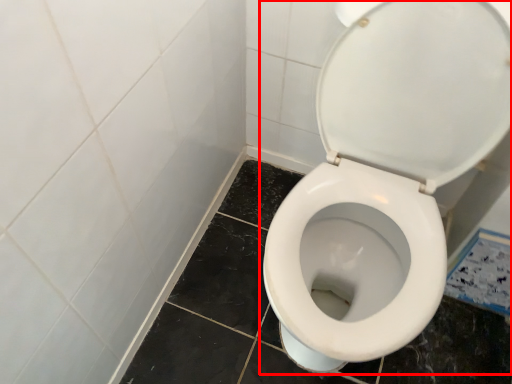
Question: In this image, where is toilet (annotated by the red box) located relative to ceramic tile?

Choices:
 (A) left
 (B) right

Answer: (A)